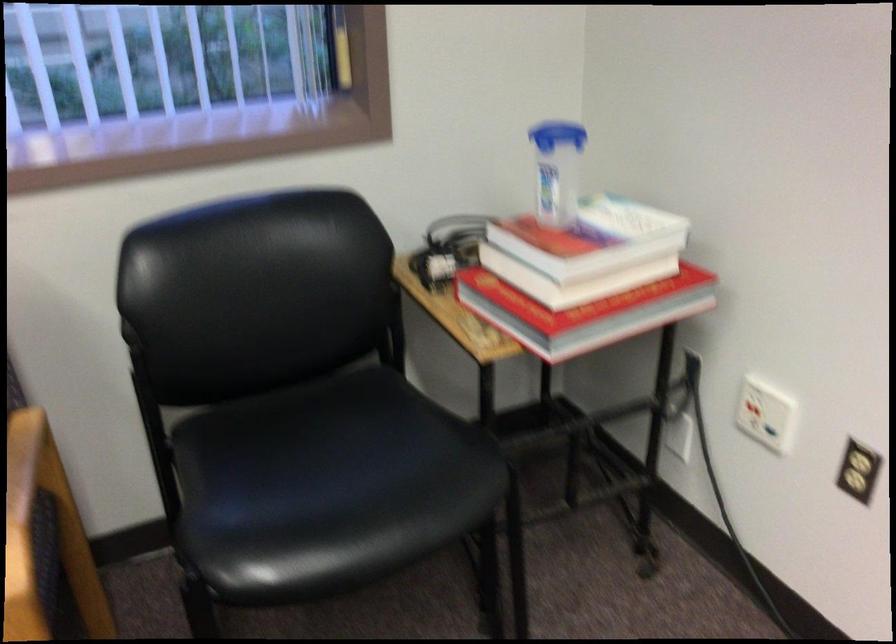
Which object does [591,238] point to?

It corresponds to the top book in the image.